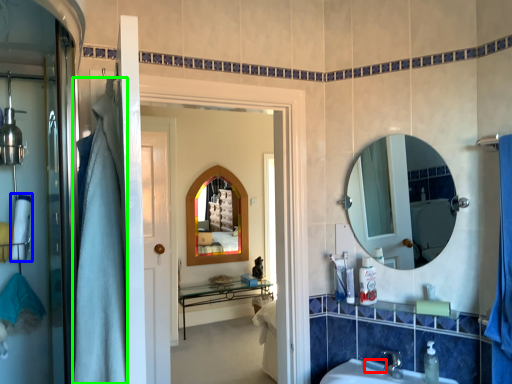
Question: Estimate the real-world distances between objects in this image. Which object is farther from soap (highlighted by a red box), bath towel (highlighted by a blue box) or shower curtain (highlighted by a green box)?

Choices:
 (A) bath towel
 (B) shower curtain

Answer: (A)